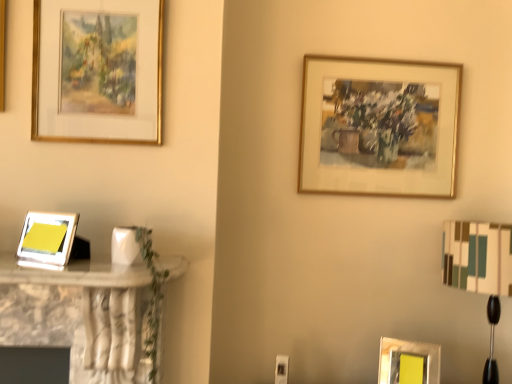
At what (x,y) coordinates should I click in order to perform the action: click on empty space that is ontop of gold metallic picture frame at upper right, the 4th picture frame from the front. Please return your answer as a coordinate pair (x, y). The height and width of the screenshot is (384, 512). Looking at the image, I should click on (384, 50).